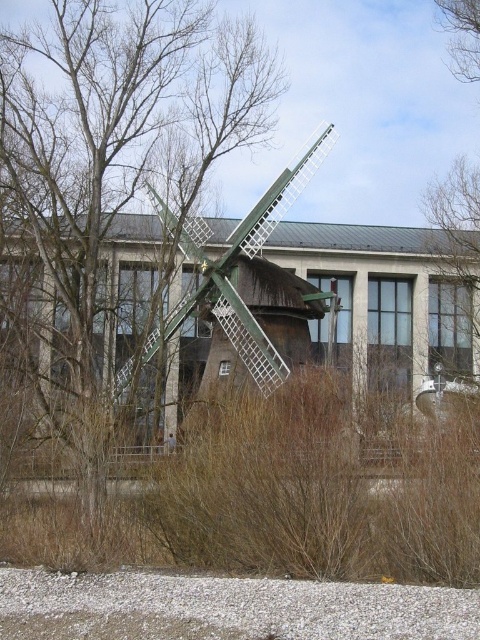
Question: Can you confirm if brown leafless tree at center is thinner than green matte windmill at center?

Choices:
 (A) no
 (B) yes

Answer: (A)

Question: Which of the following is the closest to the observer?

Choices:
 (A) (61, 266)
 (B) (186, 225)

Answer: (A)

Question: Is brown leafless tree at center above green matte windmill at center?

Choices:
 (A) no
 (B) yes

Answer: (A)

Question: Can you confirm if brown leafless tree at center is positioned below green matte windmill at center?

Choices:
 (A) no
 (B) yes

Answer: (B)

Question: Which object is closer to the camera taking this photo?

Choices:
 (A) green matte windmill at center
 (B) brown leafless tree at center

Answer: (B)